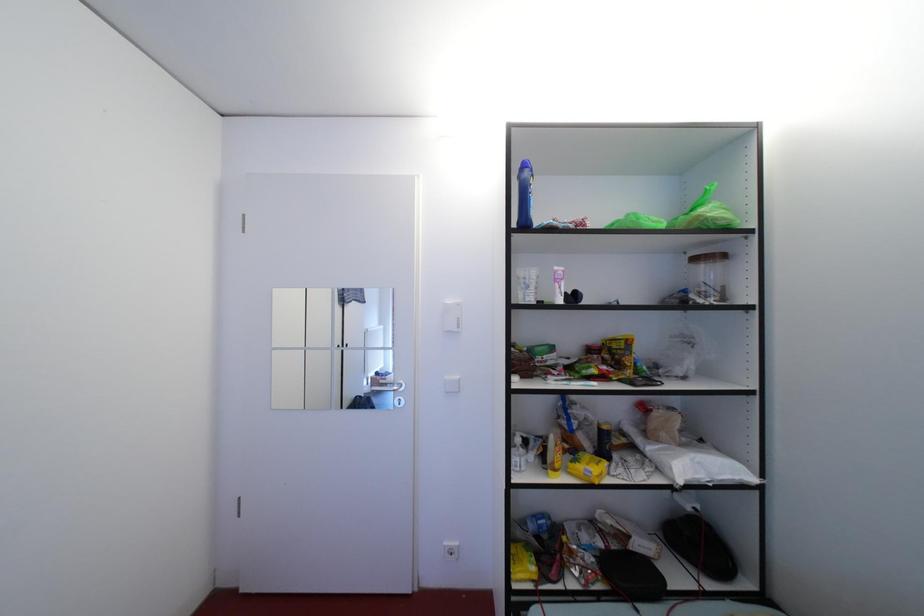
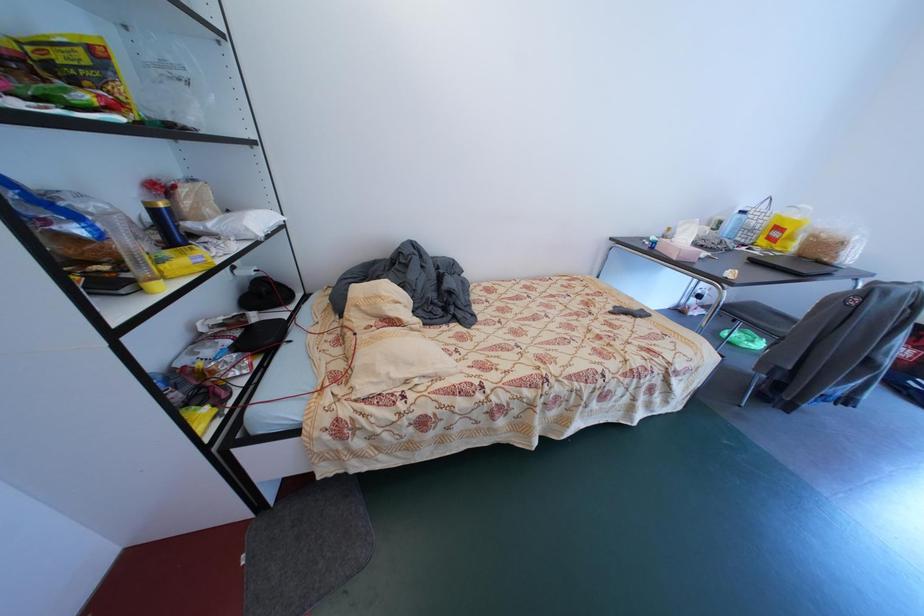
First-person continuous shooting, in which direction is the camera rotating?

The rotation direction of the camera is right-down.